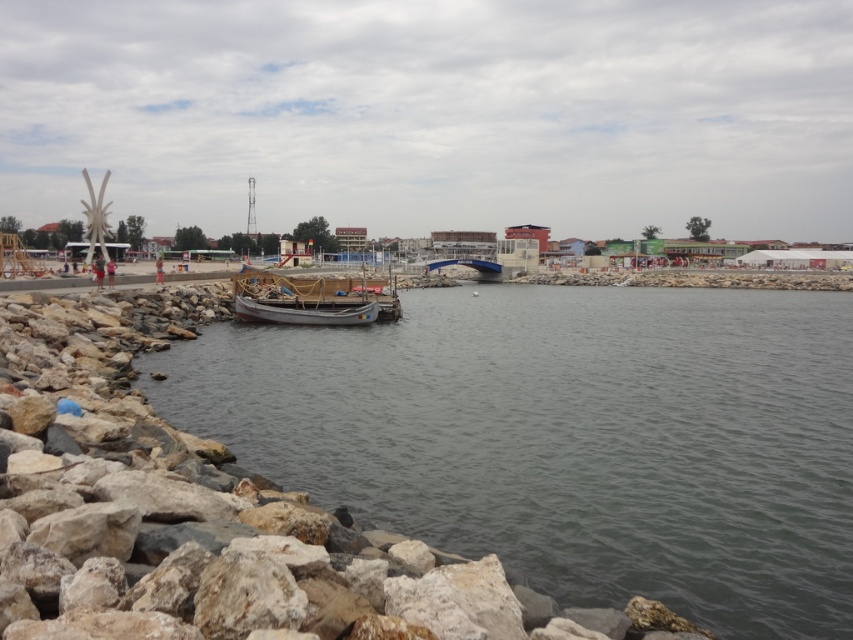
Who is positioned more to the right, clear water at lower left or wooden boat at center?

clear water at lower left

Which is behind, point (654, 416) or point (370, 305)?

Point (370, 305)

I want to click on clear water at lower left, so click(567, 438).